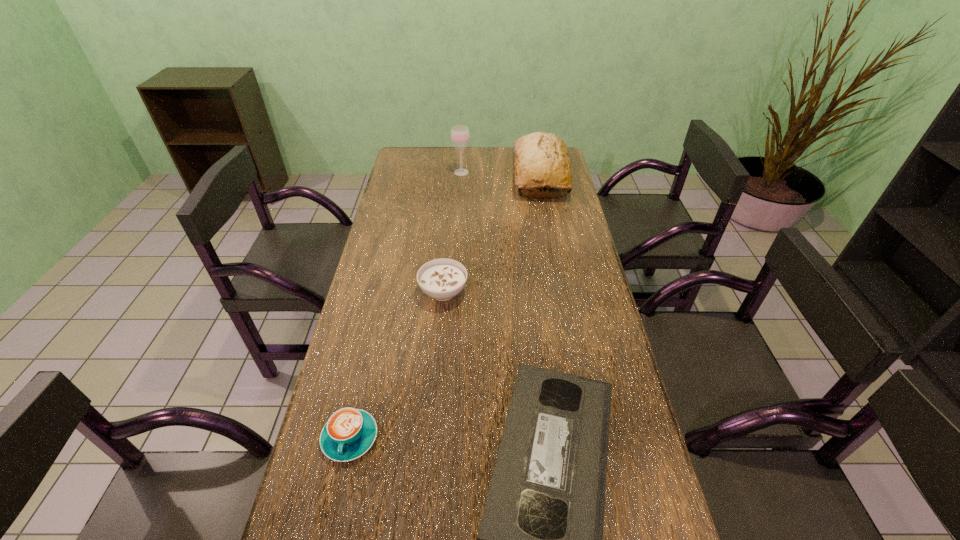
The image size is (960, 540). Identify the location of wineglass. (460, 136).

I want to click on bread, so click(541, 159).

Identify the location of the third farthest object. (442, 279).

In order to click on cappuccino in this screenshot , I will do `click(349, 433)`.

Where is `vacant position located on the front of the tallest object`? Image resolution: width=960 pixels, height=540 pixels. vacant position located on the front of the tallest object is located at coordinates (458, 225).

Identify the location of free region located on the front of the second tallest object. (554, 251).

You are a GUI agent. You are given a task and a screenshot of the screen. Output one action in this format:
    pyautogui.click(x=<x>, y=<y>)
    Task: Click on the vacant space positioned on the back of the soup bowl
    
    Given the screenshot: What is the action you would take?
    pyautogui.click(x=445, y=265)

Where is `vacant space situated 0.060m with the handle on the right side of the leftmost object`? The image size is (960, 540). vacant space situated 0.060m with the handle on the right side of the leftmost object is located at coordinates (x=337, y=494).

The image size is (960, 540). I want to click on wineglass positioned at the far edge, so click(460, 136).

I want to click on bread that is at the far edge, so click(x=541, y=159).